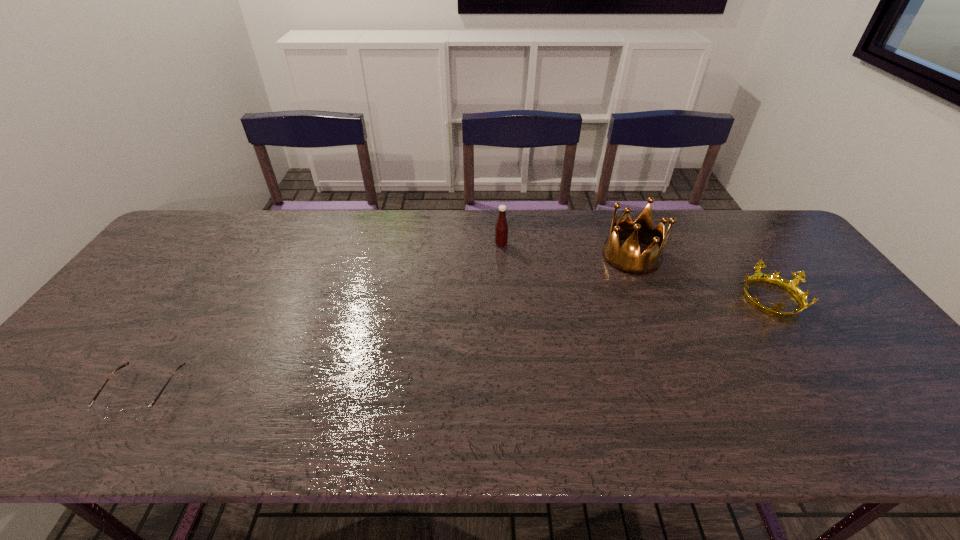
You are a GUI agent. You are given a task and a screenshot of the screen. Output one action in this format:
    pyautogui.click(x=<x>, y=<y>)
    Task: Click on the vacant space located 0.290m on the front of the second shortest object
    
    Given the screenshot: What is the action you would take?
    pyautogui.click(x=854, y=421)

Find the location of `blank area located 0.050m on the front-facing side of the leftmost object`. blank area located 0.050m on the front-facing side of the leftmost object is located at coordinates (111, 443).

At what (x,y) coordinates should I click in order to perform the action: click on crown present at the far edge. Please return your answer as a coordinate pair (x, y). Looking at the image, I should click on (627, 259).

Identify the location of Tabasco sauce that is at the far edge. This screenshot has height=540, width=960. (501, 228).

Identify the location of object located in the near edge section of the desktop. (137, 412).

The image size is (960, 540). What are the coordinates of `object present at the right edge` in the screenshot? It's located at (791, 286).

Where is `vacant space at the far edge of the desktop`? vacant space at the far edge of the desktop is located at coordinates (219, 251).

This screenshot has height=540, width=960. What are the coordinates of `free space at the near edge of the desktop` in the screenshot? It's located at (89, 446).

Locate an element on the screen. The height and width of the screenshot is (540, 960). vacant space at the left edge of the desktop is located at coordinates (202, 264).

The width and height of the screenshot is (960, 540). Find the location of `vacant space at the right edge of the desktop`. vacant space at the right edge of the desktop is located at coordinates (881, 378).